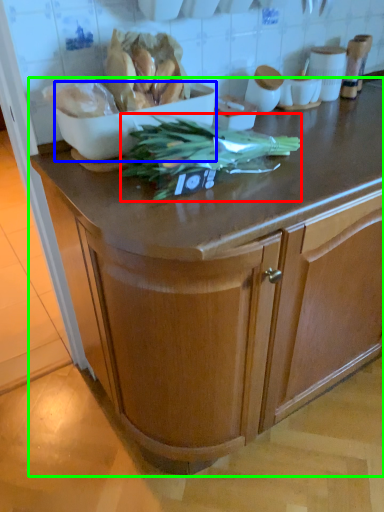
Question: Considering the real-world distances, which object is farthest from vegetable (highlighted by a red box)? bowl (highlighted by a blue box) or cabinetry (highlighted by a green box)?

Choices:
 (A) bowl
 (B) cabinetry

Answer: (B)